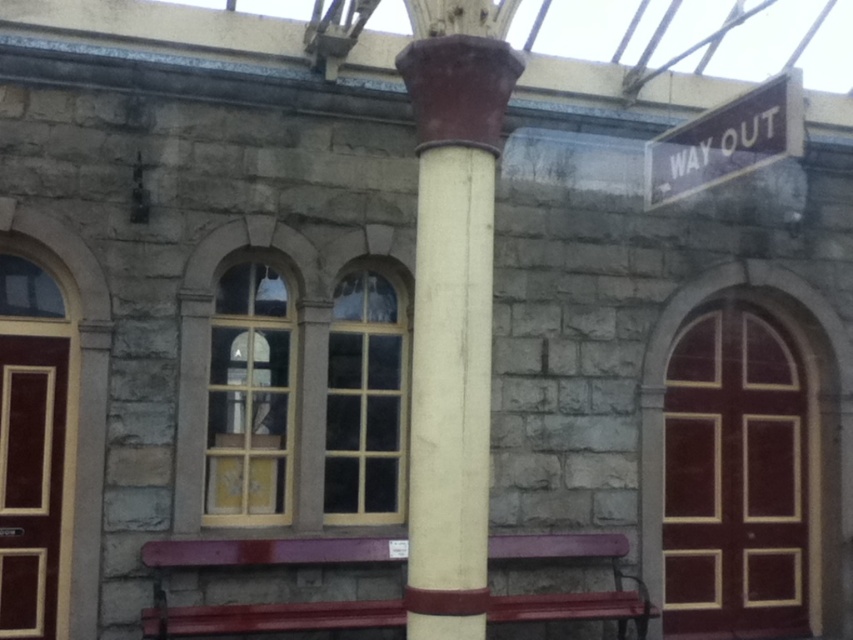
You are a maintenance worker needing to replace the bench. You see the white glossy column at center and the maroon painted wood bench at center. Which object is positioned higher relative to the other?

The white glossy column at center is located above the maroon painted wood bench at center, so the column is positioned higher than the bench.

You are a maintenance worker needing to replace a light fixture. You see the white glossy column at center and the maroon painted wood bench at center. Which object is taller and should you climb a ladder to reach the light fixture on?

The white glossy column at center is much taller than the maroon painted wood bench at center, so you should climb a ladder to reach the light fixture on the white glossy column at center.

You are a maintenance worker needing to replace the brown wooden sign at upper right. You have a ladder that can reach up to 3 meters. The white glossy column at center is in your way. Can you move the ladder around the column to access the sign?

The white glossy column at center is larger in size than brown wooden sign at upper right. Since the column is larger, it might block the path. However, the exact distance isn not provided. Assuming the column is positioned centrally, you might need to move the ladder to either side of the column to reach the sign. Check the clearance around the column to ensure the ladder can fit.